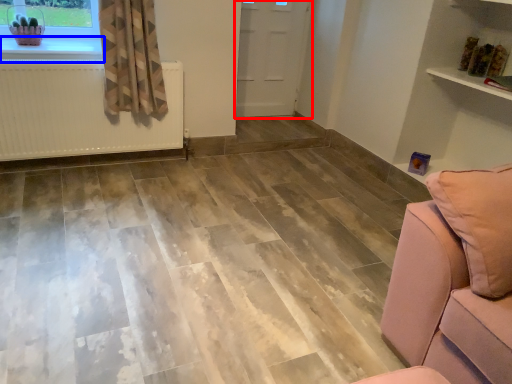
Question: Which object appears farthest to the camera in this image, door (highlighted by a red box) or window sill (highlighted by a blue box)?

Choices:
 (A) door
 (B) window sill

Answer: (A)